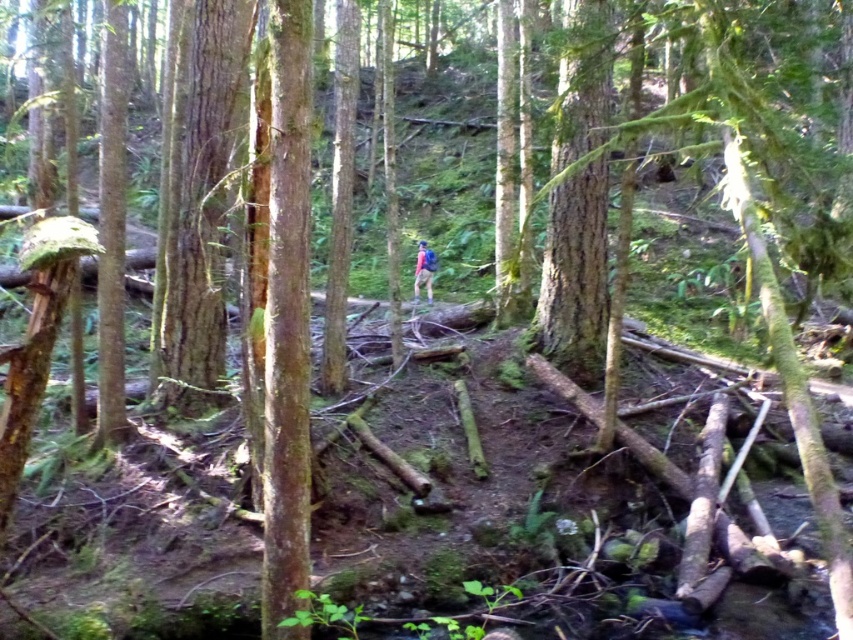
Can you confirm if smooth brown tree trunk at center is wider than matte pink backpack at center?

Incorrect, smooth brown tree trunk at center's width does not surpass matte pink backpack at center's.

Is point (279, 285) less distant than point (416, 257)?

That is True.

Locate an element on the screen. The width and height of the screenshot is (853, 640). smooth brown tree trunk at center is located at coordinates (287, 323).